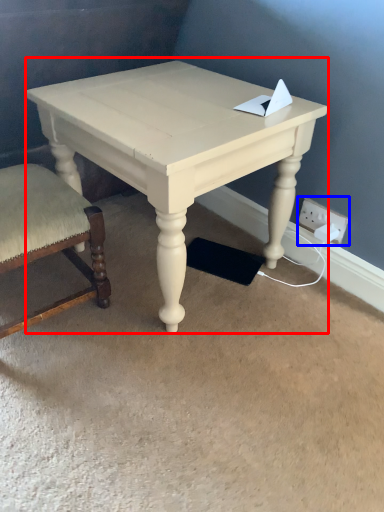
Question: Which point is closer to the camera, table (highlighted by a red box) or electric outlet (highlighted by a blue box)?

Choices:
 (A) table
 (B) electric outlet

Answer: (A)